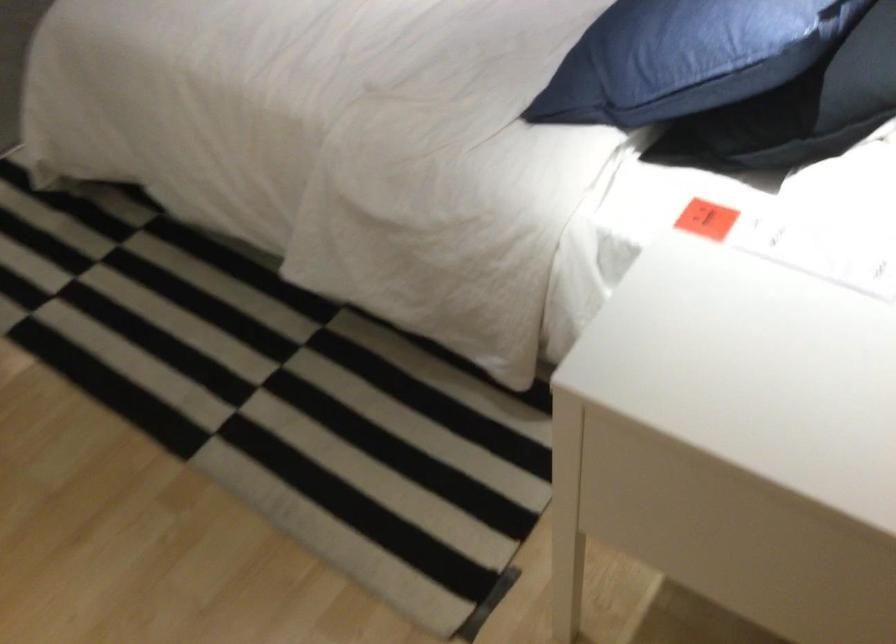
Where would you lift the blue pillow? Please return your answer as a coordinate pair (x, y).

(675, 58)